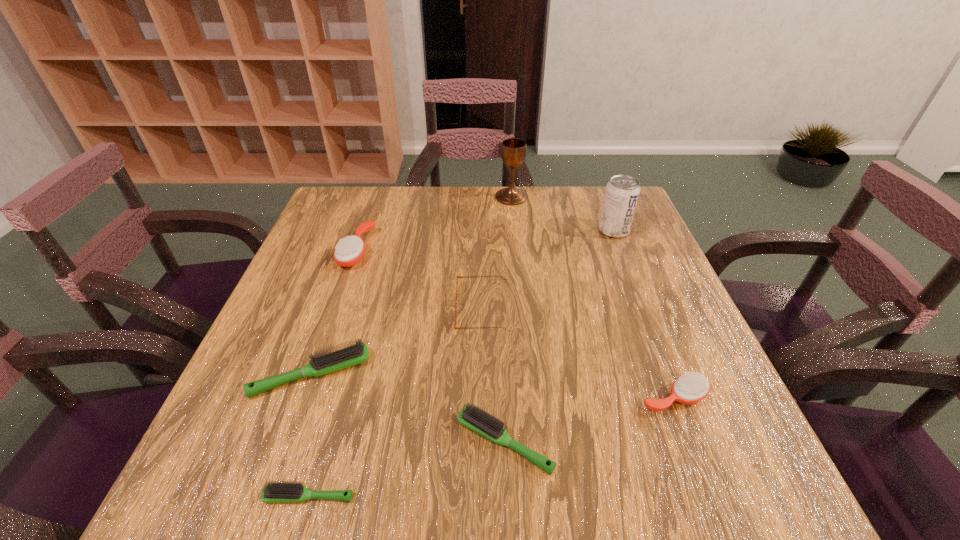
The width and height of the screenshot is (960, 540). I want to click on light hairbrush that is the second closest to the farther orange hairbrush, so click(483, 423).

Choose which light hairbrush is the nearest neighbor to the shortest hairbrush. Please provide its 2D coordinates. Your answer should be formatted as a tuple, i.e. [(x, y)], where the tuple contains the x and y coordinates of a point satisfying the conditions above.

[(358, 353)]

Locate an element on the screen. The width and height of the screenshot is (960, 540). vacant space that satisfies the following two spatial constraints: 1. on the front side of the farthest object; 2. on the face of the sunglasses is located at coordinates (523, 309).

Find the location of a particular element. The image size is (960, 540). vacant point that satisfies the following two spatial constraints: 1. on the back side of the second tallest object; 2. on the right side of the shortest object is located at coordinates (384, 231).

The width and height of the screenshot is (960, 540). I want to click on free space that satisfies the following two spatial constraints: 1. on the back side of the smaller orange hairbrush; 2. on the face of the sunglasses, so click(639, 309).

Locate an element on the screen. This screenshot has height=540, width=960. free spot that satisfies the following two spatial constraints: 1. on the back side of the biggest light hairbrush; 2. on the right side of the seventh shortest object is located at coordinates (361, 231).